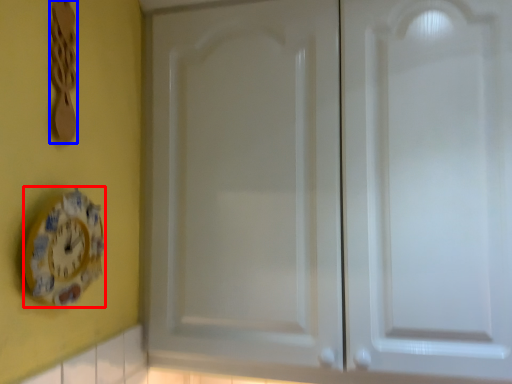
Question: Which object is closer to the camera taking this photo, clock (highlighted by a red box) or spoon (highlighted by a blue box)?

Choices:
 (A) clock
 (B) spoon

Answer: (A)